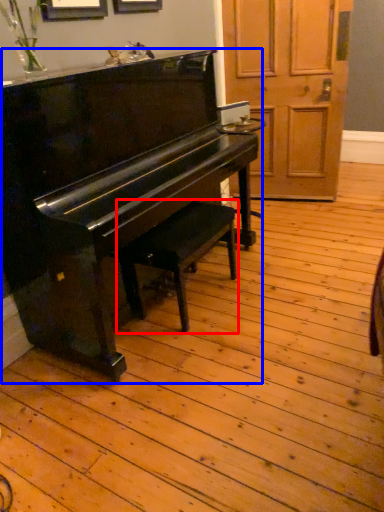
Question: Among these objects, which one is farthest to the camera, music stool (highlighted by a red box) or piano (highlighted by a blue box)?

Choices:
 (A) music stool
 (B) piano

Answer: (A)